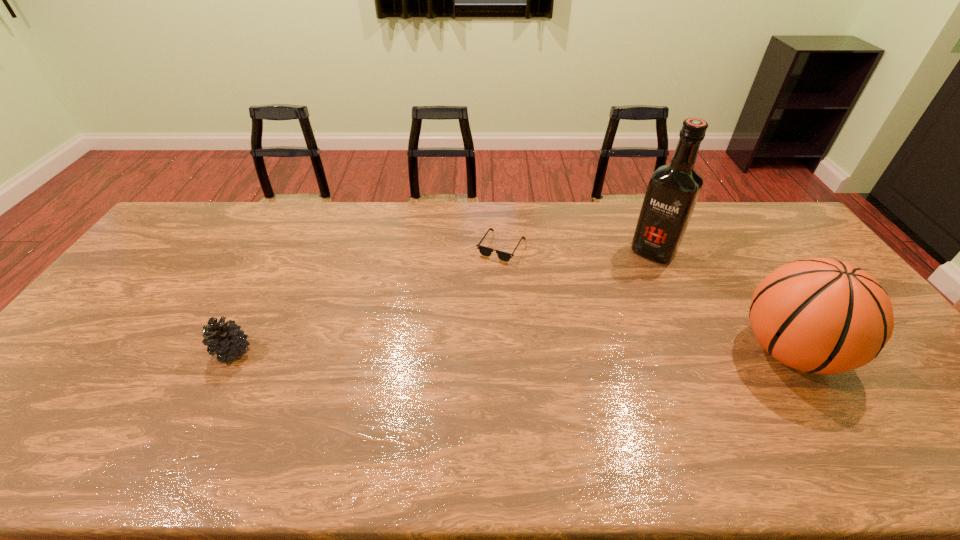
The width and height of the screenshot is (960, 540). I want to click on vacant space situated 0.250m on the front-facing side of the liquor, so coord(611,307).

Locate an element on the screen. The image size is (960, 540). vacant space situated 0.220m on the front-facing side of the liquor is located at coordinates (614, 301).

Identify the location of vacant space located on the front-facing side of the liquor. The width and height of the screenshot is (960, 540). (595, 328).

You are a GUI agent. You are given a task and a screenshot of the screen. Output one action in this format:
    pyautogui.click(x=<x>, y=<y>)
    Task: Click on the free space located 0.360m on the lenses of the third object from right to left
    
    Given the screenshot: What is the action you would take?
    pyautogui.click(x=518, y=354)

Identify the location of free space located on the lenses of the third object from right to left. (513, 323).

Where is `vacant area located 0.210m on the lenses of the third object from right to left`? This screenshot has width=960, height=540. vacant area located 0.210m on the lenses of the third object from right to left is located at coordinates (512, 313).

This screenshot has width=960, height=540. What are the coordinates of `liquor that is at the far edge` in the screenshot? It's located at (673, 190).

The height and width of the screenshot is (540, 960). In order to click on sunglasses that is at the far edge in this screenshot , I will do `click(484, 251)`.

In order to click on object that is at the near edge in this screenshot , I will do `click(818, 315)`.

Locate an element on the screen. Image resolution: width=960 pixels, height=540 pixels. object located at the right edge is located at coordinates (818, 315).